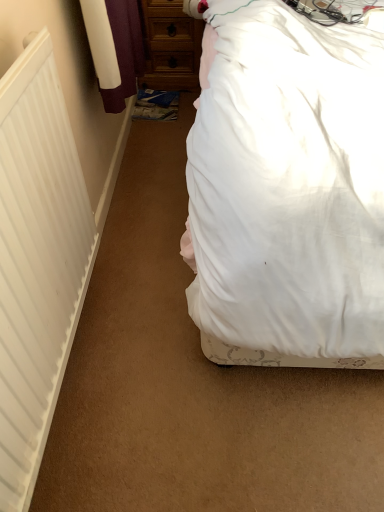
Find the location of a particular element. white fabric bed at upper right is located at coordinates (287, 190).

Identify the location of wooden chest of drawers at upper center. (170, 46).

This screenshot has height=512, width=384. I want to click on bed located in front of the white matte radiator at left, so click(287, 190).

Looking at their sizes, would you say white matte radiator at left is wider or thinner than white fabric bed at upper right?

Clearly, white matte radiator at left has less width compared to white fabric bed at upper right.

Which object is closer to the camera taking this photo, white matte radiator at left or white fabric bed at upper right?

white fabric bed at upper right.

Could you tell me if white matte radiator at left is facing white fabric bed at upper right?

Yes, white matte radiator at left is turned towards white fabric bed at upper right.

Is the position of wooden chest of drawers at upper center less distant than that of white fabric bed at upper right?

That is False.

In the scene shown: Between wooden chest of drawers at upper center and white fabric bed at upper right, which one has less height?

wooden chest of drawers at upper center.

From the image's perspective, would you say wooden chest of drawers at upper center is positioned over white fabric bed at upper right?

Yes, from the image's perspective, wooden chest of drawers at upper center is above white fabric bed at upper right.

This screenshot has height=512, width=384. Identify the location of bed in front of the wooden chest of drawers at upper center. (287, 190).

From the image's perspective, would you say white fabric bed at upper right is positioned over wooden chest of drawers at upper center?

No, from the image's perspective, white fabric bed at upper right is not on top of wooden chest of drawers at upper center.

Would you say white fabric bed at upper right is inside or outside wooden chest of drawers at upper center?

white fabric bed at upper right is spatially situated outside wooden chest of drawers at upper center.

You are a GUI agent. You are given a task and a screenshot of the screen. Output one action in this format:
    pyautogui.click(x=<x>, y=<y>)
    Task: Click on the chest of drawers on the left side of white fabric bed at upper right
    The width and height of the screenshot is (384, 512).
    Given the screenshot: What is the action you would take?
    pyautogui.click(x=170, y=46)

Which object is thinner, white fabric bed at upper right or white matte radiator at left?

white matte radiator at left is thinner.

Are white fabric bed at upper right and white matte radiator at left beside each other?

white fabric bed at upper right and white matte radiator at left are clearly separated.

Is white fabric bed at upper right bigger than white matte radiator at left?

Yes.

How different are the orientations of white fabric bed at upper right and white matte radiator at left in degrees?

The angular difference between white fabric bed at upper right and white matte radiator at left is 89.1 degrees.

Is point (14, 76) closer or farther from the camera than point (177, 77)?

Point (14, 76) appears to be closer to the viewer than point (177, 77).

Where is `radiator below the wooden chest of drawers at upper center (from the image's perspective)`? The height and width of the screenshot is (512, 384). radiator below the wooden chest of drawers at upper center (from the image's perspective) is located at coordinates (37, 261).

Visually, is white matte radiator at left positioned to the left or to the right of wooden chest of drawers at upper center?

Based on their positions, white matte radiator at left is located to the left of wooden chest of drawers at upper center.

Which of these two, white matte radiator at left or wooden chest of drawers at upper center, is thinner?

With smaller width is white matte radiator at left.

Considering the sizes of objects wooden chest of drawers at upper center and white matte radiator at left in the image provided, who is bigger, wooden chest of drawers at upper center or white matte radiator at left?

With larger size is wooden chest of drawers at upper center.

Is point (181, 48) more distant than point (46, 395)?

That is True.

Measure the distance between wooden chest of drawers at upper center and white matte radiator at left.

The distance of wooden chest of drawers at upper center from white matte radiator at left is 4.67 feet.

Which object is more forward, wooden chest of drawers at upper center or white matte radiator at left?

white matte radiator at left is more forward.

What are the coordinates of `radiator that is below the white fabric bed at upper right (from the image's perspective)` in the screenshot? It's located at (37, 261).

Locate an element on the screen. This screenshot has width=384, height=512. bed that is in front of the wooden chest of drawers at upper center is located at coordinates (287, 190).

From the image, which object appears to be farther from white fabric bed at upper right, wooden chest of drawers at upper center or white matte radiator at left?

wooden chest of drawers at upper center.

When comparing their distances from wooden chest of drawers at upper center, does white matte radiator at left or white fabric bed at upper right seem further?

The object further to wooden chest of drawers at upper center is white matte radiator at left.

Based on their spatial positions, is white fabric bed at upper right or white matte radiator at left further from wooden chest of drawers at upper center?

white matte radiator at left is positioned further to the anchor wooden chest of drawers at upper center.

Estimate the real-world distances between objects in this image. Which object is closer to white fabric bed at upper right, white matte radiator at left or wooden chest of drawers at upper center?

The object closer to white fabric bed at upper right is white matte radiator at left.

Looking at this image, based on their spatial positions, is white fabric bed at upper right or wooden chest of drawers at upper center closer to white matte radiator at left?

Based on the image, white fabric bed at upper right appears to be nearer to white matte radiator at left.

Looking at the image, which one is located closer to white matte radiator at left, wooden chest of drawers at upper center or white fabric bed at upper right?

white fabric bed at upper right lies closer to white matte radiator at left than the other object.

In order to click on radiator located between white fabric bed at upper right and wooden chest of drawers at upper center in the depth direction in this screenshot , I will do `click(37, 261)`.